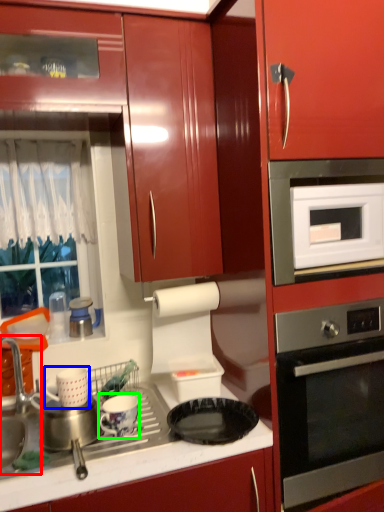
Question: Which is nearer to the sink (highlighted by a red box)? appliance (highlighted by a blue box) or appliance (highlighted by a green box).

Choices:
 (A) appliance
 (B) appliance

Answer: (A)